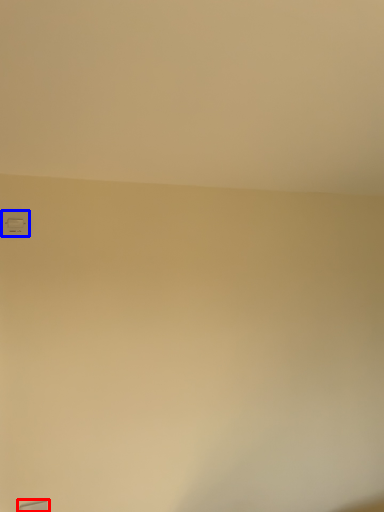
Question: Which of the following is the closest to the observer, window (highlighted by a red box) or light switch (highlighted by a blue box)?

Choices:
 (A) window
 (B) light switch

Answer: (A)